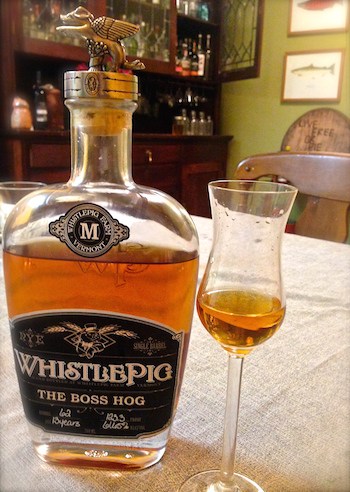
Identify the location of green wall. (264, 136).